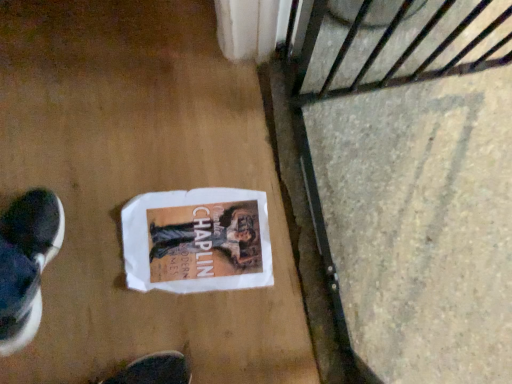
The width and height of the screenshot is (512, 384). In order to click on free space above white paper comic book at center (from a real-world perspective) in this screenshot , I will do `click(197, 241)`.